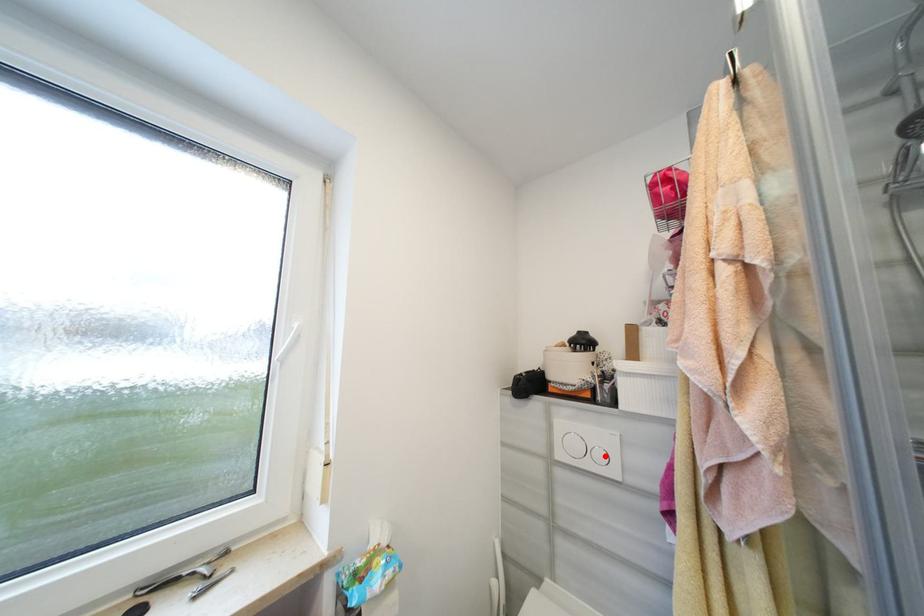
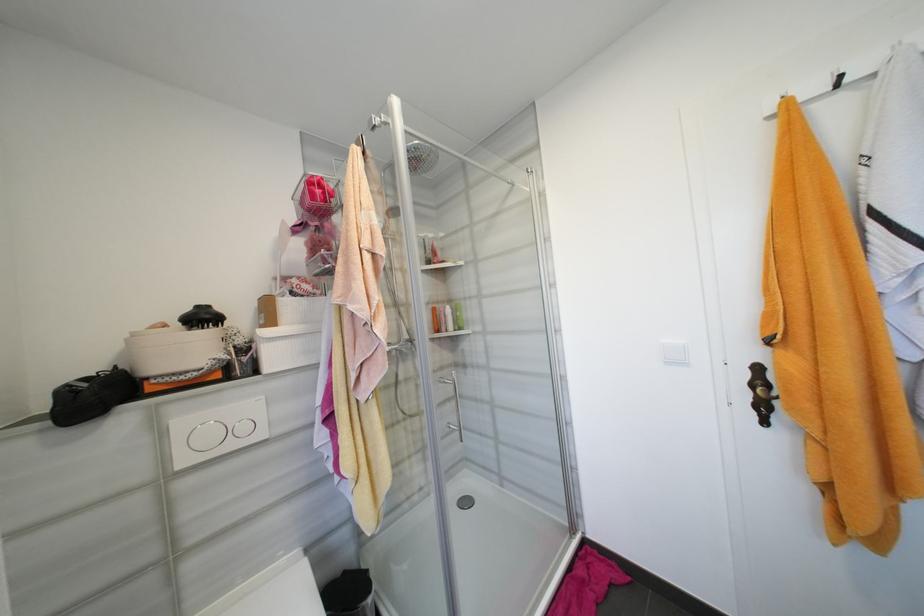
Question: I am providing you with two images of the same scene from different viewpoints. Given a red point in image1, look at the same physical point in image2. Is it:

Choices:
 (A) Closer to the viewpoint
 (B) Farther from the viewpoint

Answer: (A)